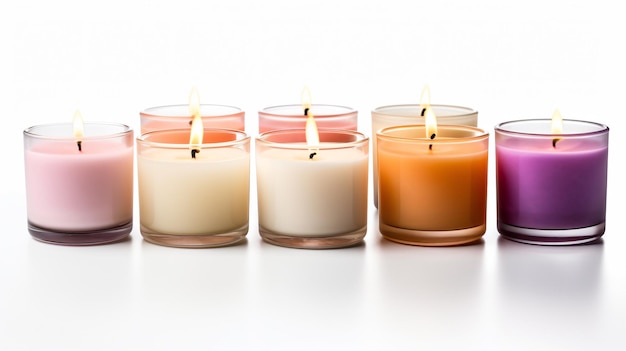
What are the coordinates of `candles` in the screenshot? It's located at (91, 195), (187, 208), (294, 209), (399, 203), (550, 202), (381, 115), (335, 116), (221, 122).